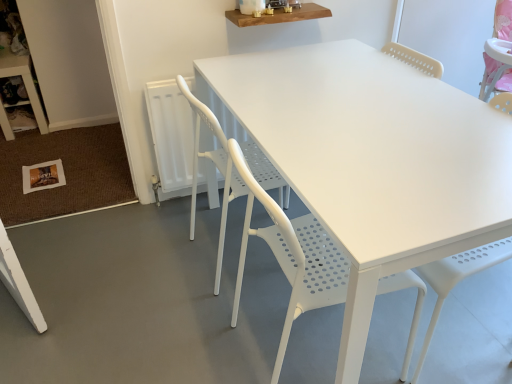
You are a GUI agent. You are given a task and a screenshot of the screen. Output one action in this format:
    pyautogui.click(x=<x>, y=<y>)
    Task: Click on the vacant region to the left of white perforated plastic chair at center, arranged as the first chair when viewed from the front
    
    Given the screenshot: What is the action you would take?
    pyautogui.click(x=189, y=330)